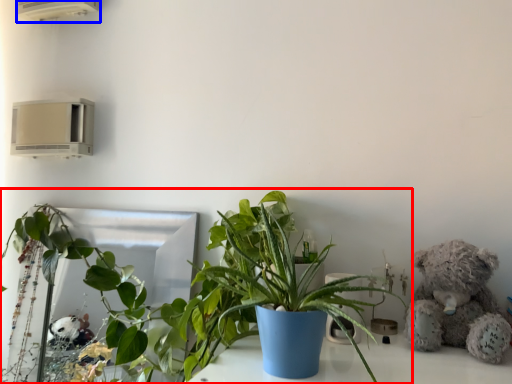
Question: Which point is further to the camera, houseplant (highlighted by a red box) or air conditioning (highlighted by a blue box)?

Choices:
 (A) houseplant
 (B) air conditioning

Answer: (B)